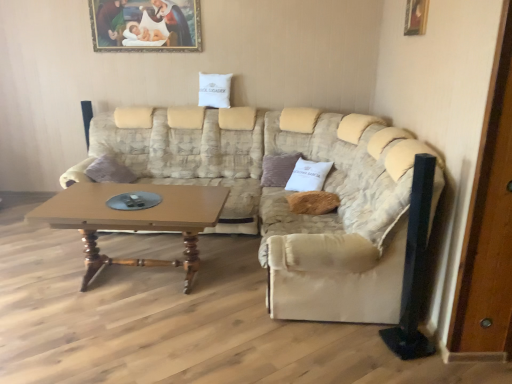
The width and height of the screenshot is (512, 384). What do you see at coordinates (287, 204) in the screenshot?
I see `beige fabric couch at center` at bounding box center [287, 204].

This screenshot has width=512, height=384. I want to click on white cotton pillow at upper center, positioned as the third pillow in right-to-left order, so click(214, 90).

Locate an element on the screen. The height and width of the screenshot is (384, 512). wooden framed painting at upper center, positioned as the 1th picture frame in left-to-right order is located at coordinates (145, 25).

Image resolution: width=512 pixels, height=384 pixels. Describe the element at coordinates (134, 219) in the screenshot. I see `wooden polished coffee table at center` at that location.

Measure the distance between wooden picture frame at upper right, which is the second picture frame from back to front, and camera.

wooden picture frame at upper right, which is the second picture frame from back to front, is 9.02 feet away from camera.

Measure the distance between point (423, 18) and camera.

Point (423, 18) is 2.86 meters from camera.

You are a GUI agent. You are given a task and a screenshot of the screen. Output one action in this format:
    pyautogui.click(x=<x>, y=<y>)
    Task: Click on the fuzzy beige pillow at center, which is the 3th pillow in left-to-right order
    Image resolution: width=512 pixels, height=384 pixels.
    Given the screenshot: What is the action you would take?
    pyautogui.click(x=313, y=202)

Consider the image. From a real-world perspective, between wooden framed painting at upper center, the first picture frame positioned from the back, and beige fabric couch at right, who is vertically lower?

beige fabric couch at right, from a real-world perspective.

Considering the sizes of wooden framed painting at upper center, positioned as the 1th picture frame in left-to-right order, and beige fabric couch at right in the image, is wooden framed painting at upper center, positioned as the 1th picture frame in left-to-right order, bigger or smaller than beige fabric couch at right?

wooden framed painting at upper center, positioned as the 1th picture frame in left-to-right order, is smaller than beige fabric couch at right.

Is the depth of wooden framed painting at upper center, marked as the 2th picture frame in a front-to-back arrangement, less than that of beige fabric couch at right?

No, it is not.

Identify the location of beige on the right of wooden framed painting at upper center, placed as the 2th picture frame when sorted from right to left. This screenshot has height=384, width=512. (340, 222).

Considering the sizes of wooden polished coffee table at center and brown fabric pillow at center, the second pillow in the front-to-back sequence, in the image, is wooden polished coffee table at center taller or shorter than brown fabric pillow at center, the second pillow in the front-to-back sequence,?

In the image, wooden polished coffee table at center appears to be taller than brown fabric pillow at center, the second pillow in the front-to-back sequence.

Is wooden polished coffee table at center not close to brown fabric pillow at center, the 2th pillow when ordered from top to bottom?

Yes, wooden polished coffee table at center is far from brown fabric pillow at center, the 2th pillow when ordered from top to bottom.

Can you tell me how much wooden polished coffee table at center and brown fabric pillow at center, the second pillow in the front-to-back sequence, differ in facing direction?

The angular difference between wooden polished coffee table at center and brown fabric pillow at center, the second pillow in the front-to-back sequence, is 1.85 degrees.

Measure the distance from beige fabric couch at right to wooden polished coffee table at center.

beige fabric couch at right and wooden polished coffee table at center are 38.27 inches apart from each other.

Does beige fabric couch at right come behind wooden polished coffee table at center?

No, it is not.

Between beige fabric couch at right and wooden polished coffee table at center, which one has larger width?

Wider between the two is beige fabric couch at right.

Considering the positions of objects beige fabric couch at right and wooden polished coffee table at center in the image provided, who is more to the left, beige fabric couch at right or wooden polished coffee table at center?

wooden polished coffee table at center.

Consider the image. Is brown fabric pillow at center, which ranks as the 2th pillow in left-to-right order, taller than wooden polished coffee table at center?

Incorrect, the height of brown fabric pillow at center, which ranks as the 2th pillow in left-to-right order, is not larger of that of wooden polished coffee table at center.

Based on the photo, does brown fabric pillow at center, the 2th pillow positioned from the right, have a lesser width compared to wooden polished coffee table at center?

Yes.

Which pillow is the 2nd one when counting from the right side of the wooden polished coffee table at center? Please provide its 2D coordinates.

[(278, 169)]

Which object is further away from the camera taking this photo, brown fabric pillow at center, the 2th pillow positioned from the right, or wooden polished coffee table at center?

brown fabric pillow at center, the 2th pillow positioned from the right, is further from the camera.

Considering the positions of points (497, 69) and (415, 17), is point (497, 69) farther from camera compared to point (415, 17)?

No, (497, 69) is in front of (415, 17).

Could wooden picture frame at upper right, which is the second picture frame from top to bottom, be considered to be inside wooden door at right?

That's incorrect, wooden picture frame at upper right, which is the second picture frame from top to bottom, is not inside wooden door at right.

Is wooden door at right oriented away from wooden picture frame at upper right, which ranks as the 1th picture frame in front-to-back order?

wooden door at right does not have its back to wooden picture frame at upper right, which ranks as the 1th picture frame in front-to-back order.

Is wooden door at right at the right side of wooden framed painting at upper center, placed as the first picture frame when sorted from top to bottom?

Correct, you'll find wooden door at right to the right of wooden framed painting at upper center, placed as the first picture frame when sorted from top to bottom.

Image resolution: width=512 pixels, height=384 pixels. I want to click on door that is below the wooden framed painting at upper center, placed as the 2th picture frame when sorted from right to left (from the image's perspective), so click(x=489, y=225).

Looking at this image, measure the distance between wooden door at right and wooden framed painting at upper center, marked as the 2th picture frame in a front-to-back arrangement.

wooden door at right is 3.36 meters from wooden framed painting at upper center, marked as the 2th picture frame in a front-to-back arrangement.

Based on their sizes in the image, would you say wooden door at right is bigger or smaller than wooden framed painting at upper center, placed as the 2th picture frame when sorted from right to left?

In the image, wooden door at right appears to be larger than wooden framed painting at upper center, placed as the 2th picture frame when sorted from right to left.

From a real-world perspective, is wooden polished coffee table at center physically below fuzzy beige pillow at center, the third pillow viewed from the back?

Correct, in the physical world, wooden polished coffee table at center is lower than fuzzy beige pillow at center, the third pillow viewed from the back.

Consider the image. How distant is wooden polished coffee table at center from fuzzy beige pillow at center, the 1th pillow when ordered from front to back?

The distance of wooden polished coffee table at center from fuzzy beige pillow at center, the 1th pillow when ordered from front to back, is 3.53 feet.

From the image's perspective, is wooden polished coffee table at center located above fuzzy beige pillow at center, the third pillow viewed from the back?

No, from the image's perspective, wooden polished coffee table at center is not above fuzzy beige pillow at center, the third pillow viewed from the back.

There is a beige fabric couch at right. What are the coordinates of `the 2nd picture frame above it (from a real-world perspective)` in the screenshot? It's located at (145, 25).

This screenshot has height=384, width=512. In order to click on coffee table below the brown fabric pillow at center, which ranks as the 2th pillow in left-to-right order (from a real-world perspective) in this screenshot , I will do `click(134, 219)`.

Estimate the real-world distances between objects in this image. Which object is further from wooden framed painting at upper center, the 2th picture frame when ordered from bottom to top, wooden picture frame at upper right, which ranks as the 1th picture frame in front-to-back order, or brown fabric pillow at center, the 2th pillow positioned from the right?

wooden picture frame at upper right, which ranks as the 1th picture frame in front-to-back order, is positioned further to the anchor wooden framed painting at upper center, the 2th picture frame when ordered from bottom to top.

Looking at the image, which one is located closer to wooden polished coffee table at center, white cotton pillow at upper center, the 3th pillow from the bottom, or fuzzy beige pillow at center, the third pillow viewed from the back?

→ The object closer to wooden polished coffee table at center is fuzzy beige pillow at center, the third pillow viewed from the back.

When comparing their distances from wooden framed painting at upper center, the first picture frame positioned from the back, does beige fabric couch at center or wooden polished coffee table at center seem further?

The object further to wooden framed painting at upper center, the first picture frame positioned from the back, is wooden polished coffee table at center.

Estimate the real-world distances between objects in this image. Which object is closer to wooden picture frame at upper right, which ranks as the 1th picture frame in front-to-back order, wooden door at right or fuzzy beige pillow at center, the first pillow when ordered from bottom to top?

Based on the image, fuzzy beige pillow at center, the first pillow when ordered from bottom to top, appears to be nearer to wooden picture frame at upper right, which ranks as the 1th picture frame in front-to-back order.

Looking at this image, looking at the image, which one is located further to beige fabric couch at center, wooden polished coffee table at center or fuzzy beige pillow at center, which is the 3th pillow in left-to-right order?

wooden polished coffee table at center is further to beige fabric couch at center.

From the picture: Estimate the real-world distances between objects in this image. Which object is closer to beige fabric couch at right, beige fabric couch at center or wooden door at right?

beige fabric couch at center lies closer to beige fabric couch at right than the other object.

When comparing their distances from beige fabric couch at center, does fuzzy beige pillow at center, which is the 3th pillow in left-to-right order, or wooden door at right seem closer?

Based on the image, fuzzy beige pillow at center, which is the 3th pillow in left-to-right order, appears to be nearer to beige fabric couch at center.

Which object lies further to the anchor point wooden picture frame at upper right, which is the second picture frame from top to bottom, wooden polished coffee table at center or beige fabric couch at center?

The object further to wooden picture frame at upper right, which is the second picture frame from top to bottom, is wooden polished coffee table at center.

Image resolution: width=512 pixels, height=384 pixels. I want to click on beige between wooden picture frame at upper right, which is the second picture frame from top to bottom, and fuzzy beige pillow at center, the third pillow when ordered from top to bottom, in the up-down direction, so click(x=340, y=222).

The image size is (512, 384). I want to click on coffee table located between beige fabric couch at center and white cotton pillow at upper center, arranged as the first pillow when viewed from the back, in the depth direction, so click(x=134, y=219).

The height and width of the screenshot is (384, 512). In order to click on beige between beige fabric couch at center and wooden door at right in this screenshot , I will do `click(340, 222)`.

Image resolution: width=512 pixels, height=384 pixels. Identify the location of picture frame located between beige fabric couch at right and brown fabric pillow at center, the 2th pillow positioned from the right, in the depth direction. (416, 17).